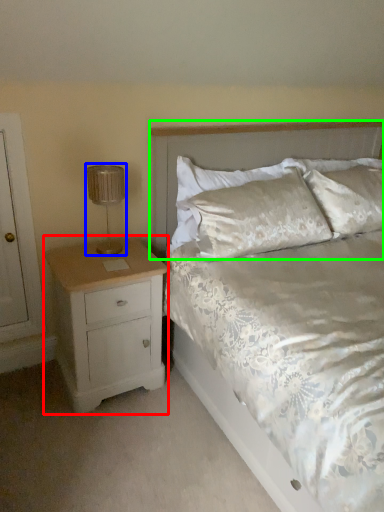
Question: Estimate the real-world distances between objects in this image. Which object is farther from nightstand (highlighted by a red box), lamp (highlighted by a blue box) or headboard (highlighted by a green box)?

Choices:
 (A) lamp
 (B) headboard

Answer: (B)